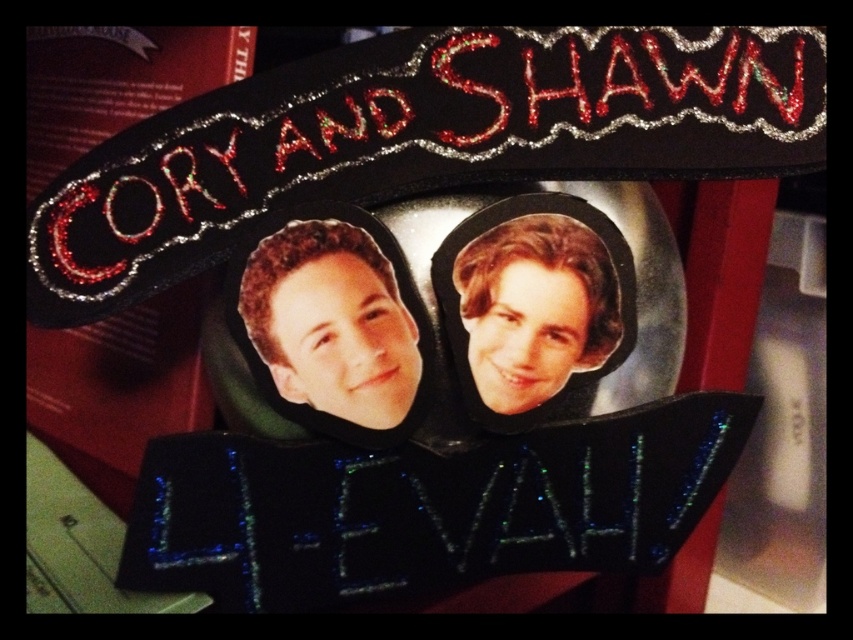
What do you see at coordinates (331, 323) in the screenshot? I see `matte plastic head at center` at bounding box center [331, 323].

Who is more distant from viewer, (x=277, y=252) or (x=482, y=390)?

The point (x=482, y=390) is more distant.

Locate an element on the screen. matte plastic head at center is located at coordinates (331, 323).

Locate an element on the screen. This screenshot has width=853, height=640. matte plastic head at center is located at coordinates (331, 323).